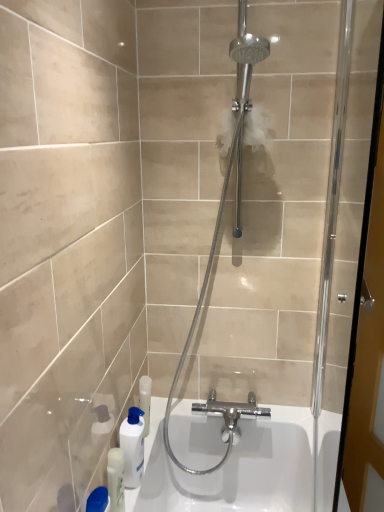
Question: Is white glossy bottle at lower left not within white glossy bottle at lower left?

Choices:
 (A) no
 (B) yes

Answer: (B)

Question: Would you consider white glossy bottle at lower left to be distant from white glossy bottle at lower left?

Choices:
 (A) yes
 (B) no

Answer: (B)

Question: Considering the relative sizes of white glossy bottle at lower left and white glossy bottle at lower left in the image provided, is white glossy bottle at lower left smaller than white glossy bottle at lower left?

Choices:
 (A) yes
 (B) no

Answer: (B)

Question: Is white glossy bottle at lower left behind white glossy bottle at lower left?

Choices:
 (A) yes
 (B) no

Answer: (A)

Question: From a real-world perspective, does white glossy bottle at lower left sit lower than white glossy bottle at lower left?

Choices:
 (A) no
 (B) yes

Answer: (A)

Question: From a real-world perspective, is white glossy bottle at lower left over white glossy bottle at lower left?

Choices:
 (A) no
 (B) yes

Answer: (B)

Question: Is white glossy bottle at lower left at the right side of polished chrome shower head at center?

Choices:
 (A) no
 (B) yes

Answer: (A)

Question: From the image's perspective, is white glossy bottle at lower left below polished chrome shower head at center?

Choices:
 (A) yes
 (B) no

Answer: (A)

Question: Does white glossy bottle at lower left have a smaller size compared to polished chrome shower head at center?

Choices:
 (A) no
 (B) yes

Answer: (B)

Question: Are white glossy bottle at lower left and polished chrome shower head at center far apart?

Choices:
 (A) yes
 (B) no

Answer: (B)

Question: Does white glossy bottle at lower left have a lesser width compared to polished chrome shower head at center?

Choices:
 (A) yes
 (B) no

Answer: (A)

Question: Is white glossy bottle at lower left not within polished chrome shower head at center?

Choices:
 (A) yes
 (B) no

Answer: (A)

Question: From the image's perspective, is white glossy bottle at lower left under polished chrome shower head at center?

Choices:
 (A) yes
 (B) no

Answer: (A)